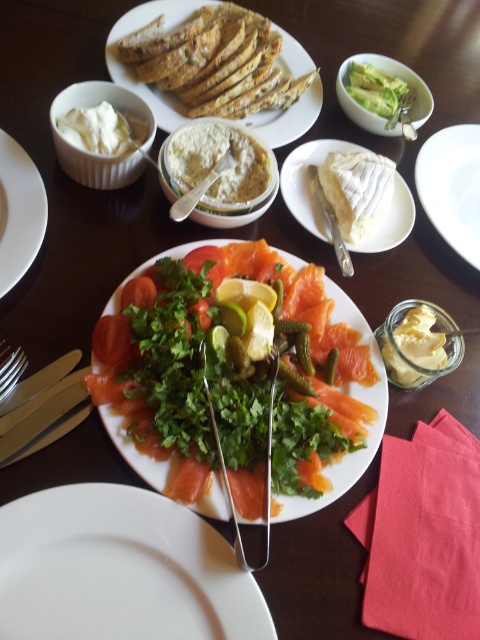
You are a GUI agent. You are given a task and a screenshot of the screen. Output one action in this format:
    pyautogui.click(x=<x>, y=<y>)
    Task: Click on the white matte plate at center
    
    Given the screenshot: What is the action you would take?
    pyautogui.click(x=120, y=570)

Does white matte plate at center have a lesser width compared to white creamy cheese at upper right?

No, white matte plate at center is not thinner than white creamy cheese at upper right.

Where is `white matte plate at center`? This screenshot has width=480, height=640. white matte plate at center is located at coordinates (120, 570).

What do you see at coordinates (132, 68) in the screenshot? The image size is (480, 640). I see `brown crusty bread at upper center` at bounding box center [132, 68].

Can you confirm if brown crusty bread at upper center is thinner than white matte plate at upper left?

No.

Who is more distant from viewer, (266, 109) or (2, 244)?

Positioned behind is point (266, 109).

The image size is (480, 640). What are the coordinates of `brown crusty bread at upper center` in the screenshot? It's located at (132, 68).

Who is lower down, fresh green salad at center or brown crusty bread at upper center?

fresh green salad at center is lower down.

Between fresh green salad at center and brown crusty bread at upper center, which one is positioned higher?

brown crusty bread at upper center is higher up.

Where is `fresh green salad at center`? The width and height of the screenshot is (480, 640). fresh green salad at center is located at coordinates (238, 380).